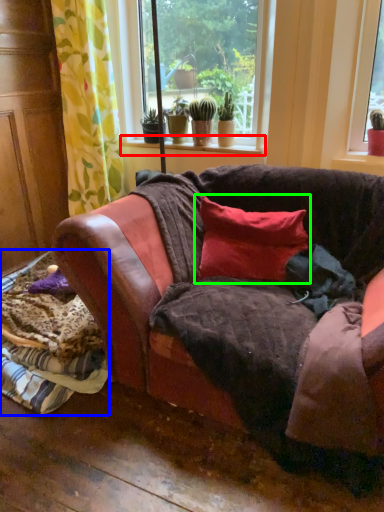
Question: Based on their relative distances, which object is nearer to window sill (highlighted by a red box)? Choose from material (highlighted by a blue box) and pillow (highlighted by a green box).

Choices:
 (A) material
 (B) pillow

Answer: (B)